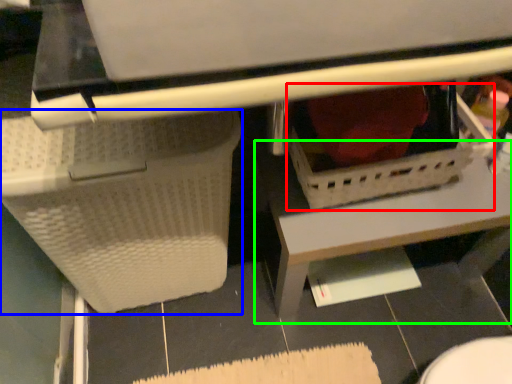
Question: Which object is the closest to the basket (highlighted by a red box)? Choose among these: basket (highlighted by a blue box) or table (highlighted by a green box).

Choices:
 (A) basket
 (B) table

Answer: (B)